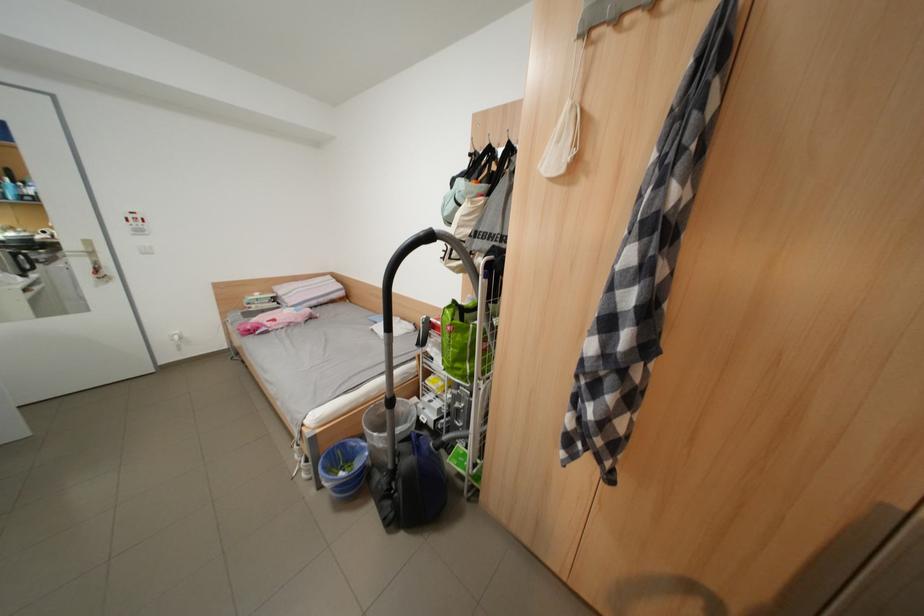
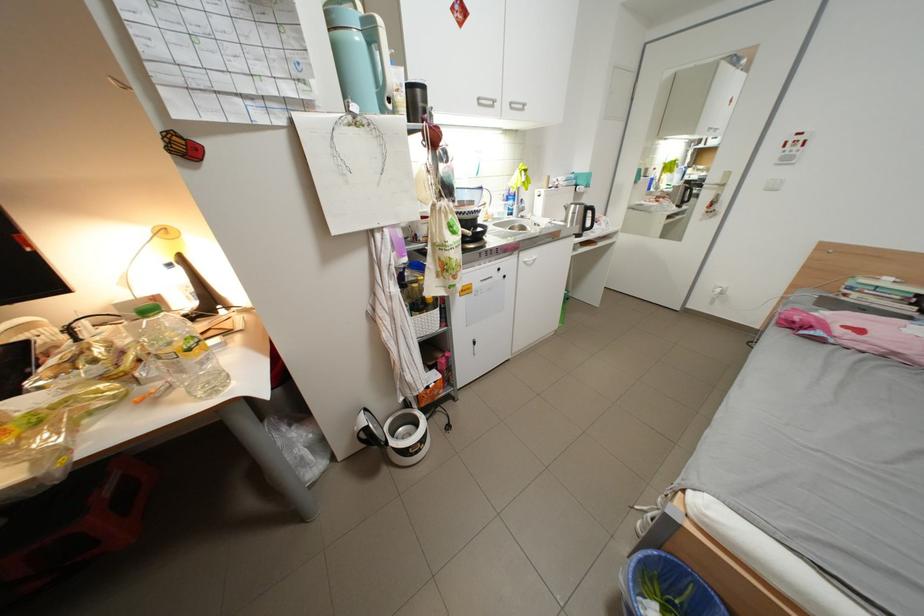
In the second image, find the point that corresponds to point (355, 447) in the first image.

(716, 600)